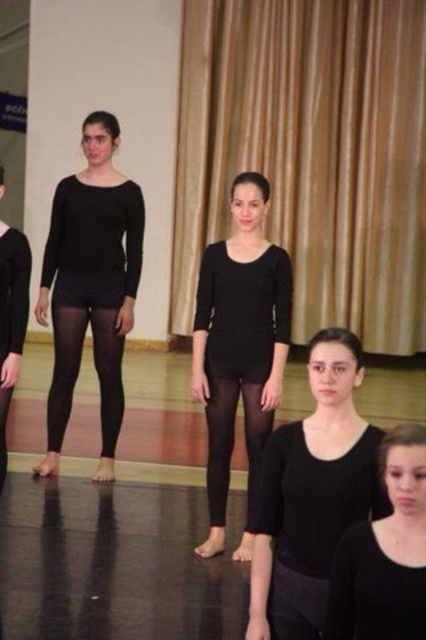
Who is positioned more to the right, gold fabric curtain at upper center or matte black leggings at center?

gold fabric curtain at upper center

Between point (224, 68) and point (252, 220), which one is positioned behind?

Point (224, 68)

Find the location of a particular element. gold fabric curtain at upper center is located at coordinates (310, 154).

Who is taller, matte black leggings at center or black tights at left?

matte black leggings at center is taller.

Describe the element at coordinates (239, 346) in the screenshot. I see `matte black leggings at center` at that location.

At what (x,y) coordinates should I click in order to perform the action: click on matte black leggings at center. Please return your answer as a coordinate pair (x, y). This screenshot has height=640, width=426. Looking at the image, I should click on (239, 346).

Does point (218, 150) lie in front of point (100, 449)?

No, it is not.

Is point (388, 268) positioned after point (66, 236)?

Yes.

Identify the location of gold fabric curtain at upper center. This screenshot has height=640, width=426. (310, 154).